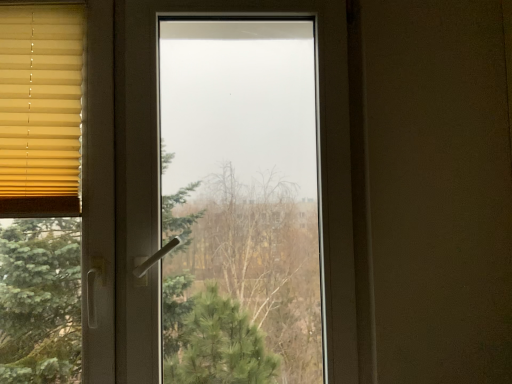
Question: Is yellow fabric blinds at left spatially inside transparent glass window at center, or outside of it?

Choices:
 (A) inside
 (B) outside

Answer: (A)

Question: Considering their positions, is yellow fabric blinds at left located in front of or behind transparent glass window at center?

Choices:
 (A) behind
 (B) front

Answer: (A)

Question: Considering the positions of yellow fabric blinds at left and transparent glass window at center in the image, is yellow fabric blinds at left taller or shorter than transparent glass window at center?

Choices:
 (A) short
 (B) tall

Answer: (A)

Question: In terms of size, does transparent glass window at center appear bigger or smaller than yellow fabric blinds at left?

Choices:
 (A) small
 (B) big

Answer: (B)

Question: Considering the positions of transparent glass window at center and yellow fabric blinds at left in the image, is transparent glass window at center taller or shorter than yellow fabric blinds at left?

Choices:
 (A) tall
 (B) short

Answer: (A)

Question: From a real-world perspective, is transparent glass window at center above or below yellow fabric blinds at left?

Choices:
 (A) above
 (B) below

Answer: (B)

Question: Is transparent glass window at center inside the boundaries of yellow fabric blinds at left, or outside?

Choices:
 (A) inside
 (B) outside

Answer: (B)